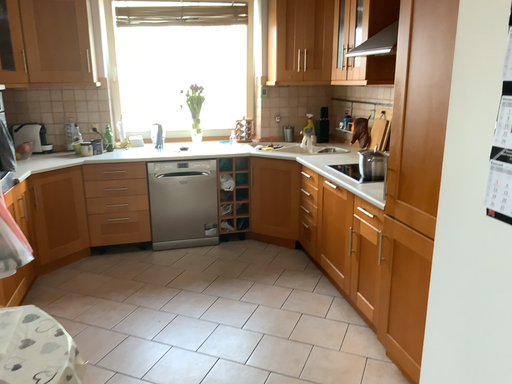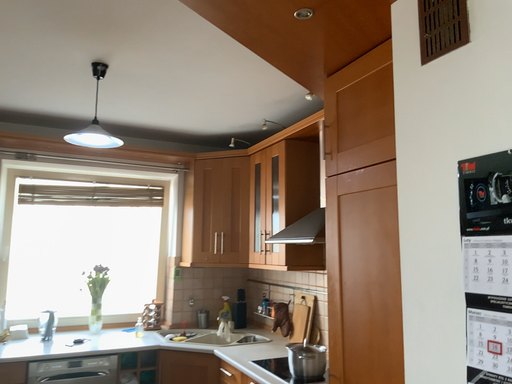
Question: How did the camera likely rotate when shooting the video?

Choices:
 (A) rotated left
 (B) rotated right

Answer: (B)